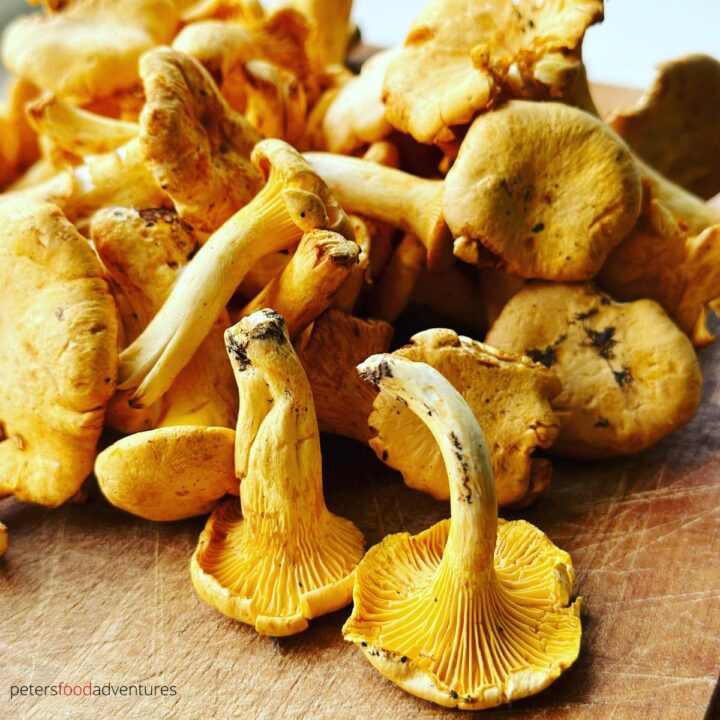
Locate an element on the screen. The height and width of the screenshot is (720, 720). cutting board is located at coordinates (623, 642).